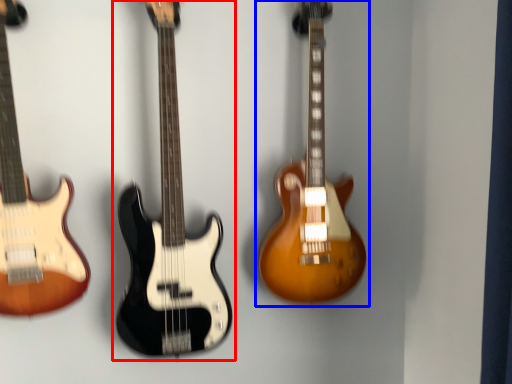
Question: Which of the following is the closest to the observer, guitar (highlighted by a red box) or guitar (highlighted by a blue box)?

Choices:
 (A) guitar
 (B) guitar

Answer: (A)